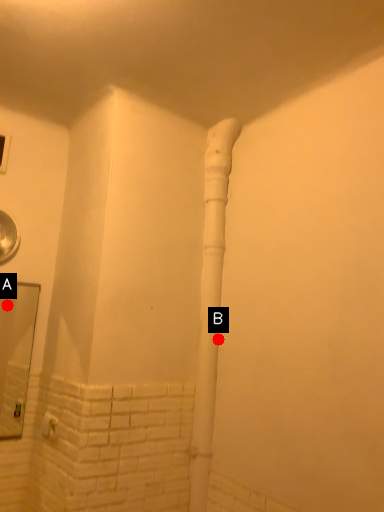
Question: Two points are circled on the image, labeled by A and B beside each circle. Which point is closer to the camera taking this photo?

Choices:
 (A) A is closer
 (B) B is closer

Answer: (B)